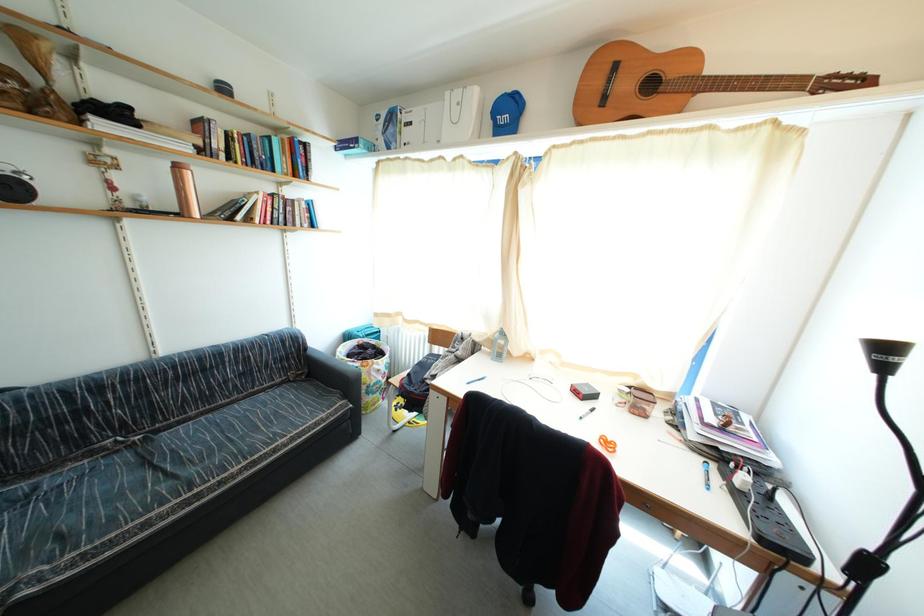
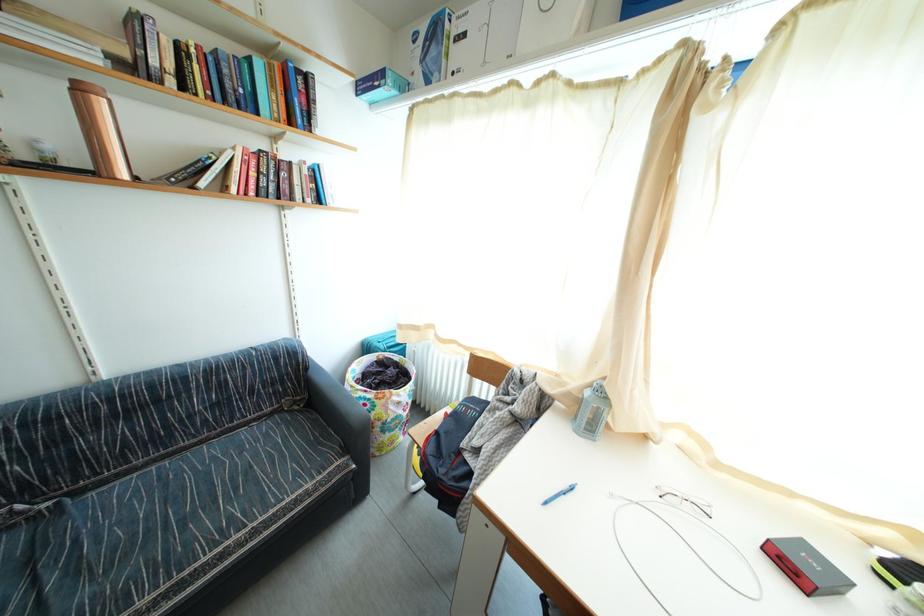
Question: What movement of the cameraman would produce the second image?

Choices:
 (A) Left
 (B) Right
 (C) Forward
 (D) Backward

Answer: (C)